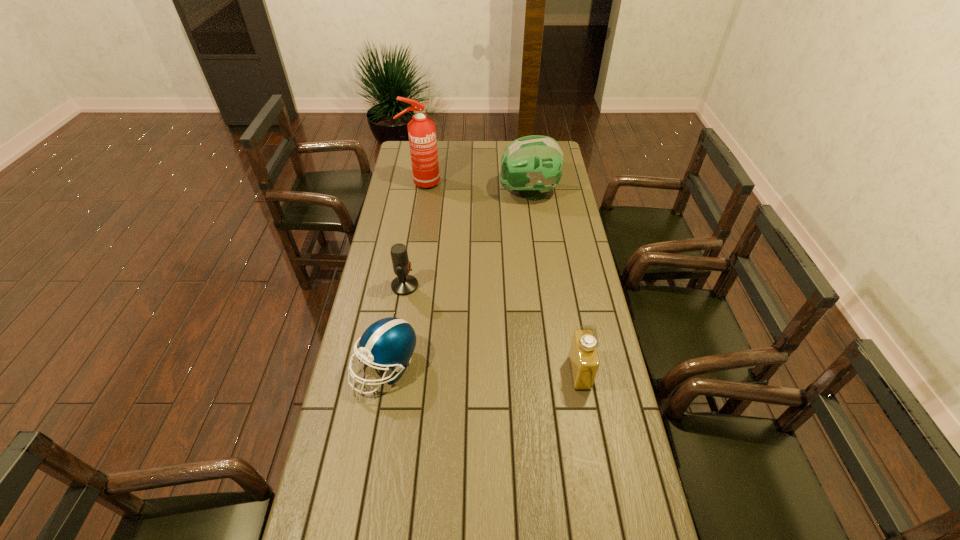
I want to click on free area in between the right football helmet and the tallest object, so (475, 188).

Identify the location of free space between the fire extinguisher and the taller football helmet. (475, 188).

I want to click on vacant area between the shorter football helmet and the farther football helmet, so click(x=457, y=280).

Where is `vacant area that lies between the perfume and the microphone`? The image size is (960, 540). vacant area that lies between the perfume and the microphone is located at coordinates (492, 329).

Select which object is the fourth closest to the shorter football helmet. Please provide its 2D coordinates. Your answer should be formatted as a tuple, i.e. [(x, y)], where the tuple contains the x and y coordinates of a point satisfying the conditions above.

[(421, 130)]

Locate an element on the screen. Image resolution: width=960 pixels, height=540 pixels. the second closest object to the left football helmet is located at coordinates (583, 356).

This screenshot has width=960, height=540. Find the location of `vacant region that satisfies the following two spatial constraints: 1. on the side of the microphone with the red ring; 2. at the front of the nearer football helmet with the faceguard`. vacant region that satisfies the following two spatial constraints: 1. on the side of the microphone with the red ring; 2. at the front of the nearer football helmet with the faceguard is located at coordinates (392, 367).

Locate an element on the screen. The image size is (960, 540). free region that satisfies the following two spatial constraints: 1. on the visor of the farther football helmet; 2. at the front of the nearer football helmet with the faceguard is located at coordinates (x=551, y=367).

Find the location of `free spot that satisfies the following two spatial constraints: 1. on the visor of the fourth shortest object; 2. at the front of the nearer football helmet with the faceguard`. free spot that satisfies the following two spatial constraints: 1. on the visor of the fourth shortest object; 2. at the front of the nearer football helmet with the faceguard is located at coordinates (551, 367).

Find the location of a particular element. This screenshot has width=960, height=540. vacant position in the image that satisfies the following two spatial constraints: 1. on the side of the third farthest object with the red ring; 2. at the front of the left football helmet with the faceguard is located at coordinates (392, 367).